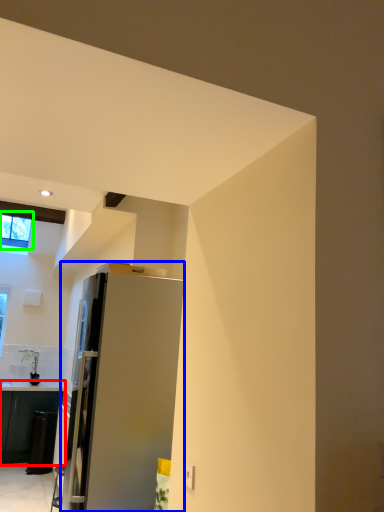
Question: Which object is positioned farthest from cabinetry (highlighted by a red box)? Select from refrigerator (highlighted by a blue box) and window (highlighted by a green box).

Choices:
 (A) refrigerator
 (B) window

Answer: (A)